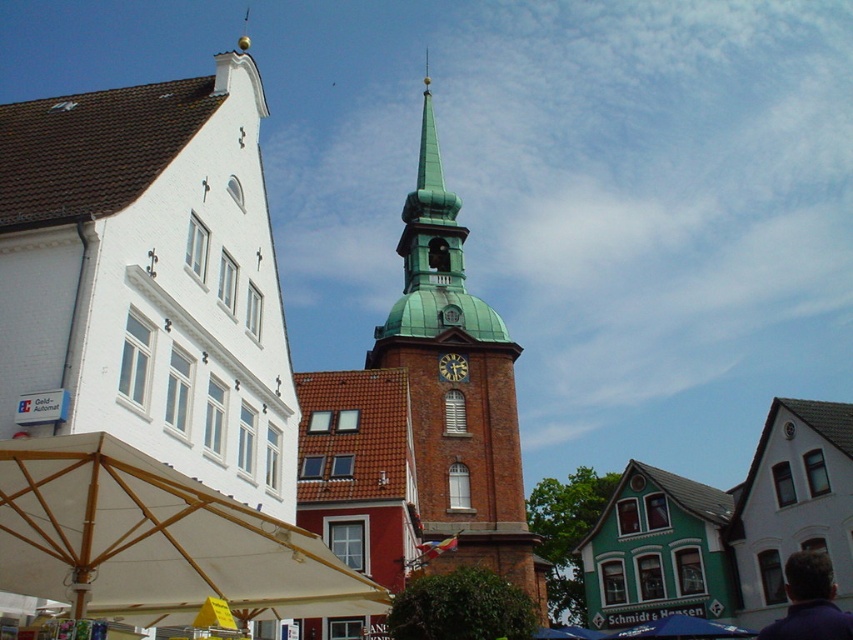
You are a tourist standing in the town square looking at the tower and the white building. You notice two fabrics in the scene. Which fabric is taller, the purple fabric at lower right or the blue fabric canopy at lower center?

The purple fabric at lower right is taller than the blue fabric canopy at lower center according to the description.

You are standing at the center of the town square facing the tower. A purple fabric at lower right is located at point 0.941, 0.950. If you want to walk directly towards it, which direction should you move relative to the tower?

The purple fabric at lower right is located at point (x=809, y=602), so you should move towards the lower right direction relative to the tower.